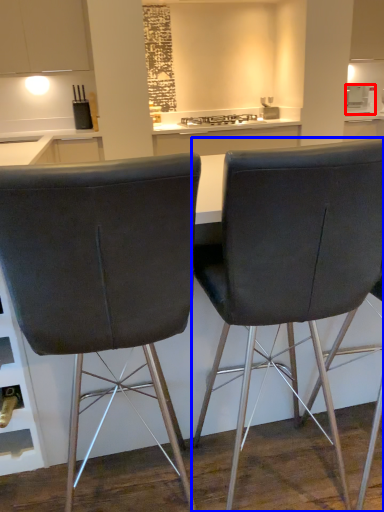
Question: Among these objects, which one is nearest to the camera, appliance (highlighted by a red box) or chair (highlighted by a blue box)?

Choices:
 (A) appliance
 (B) chair

Answer: (B)